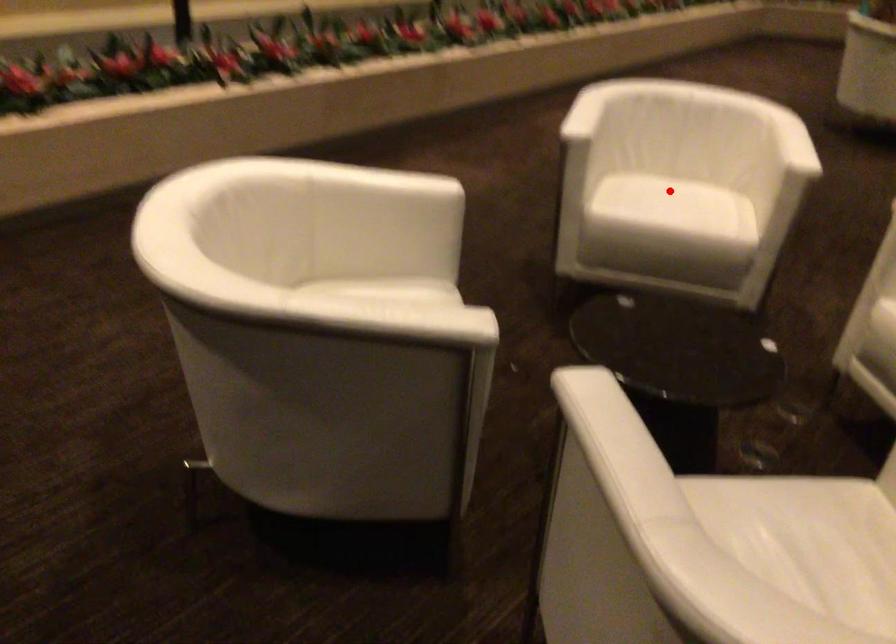
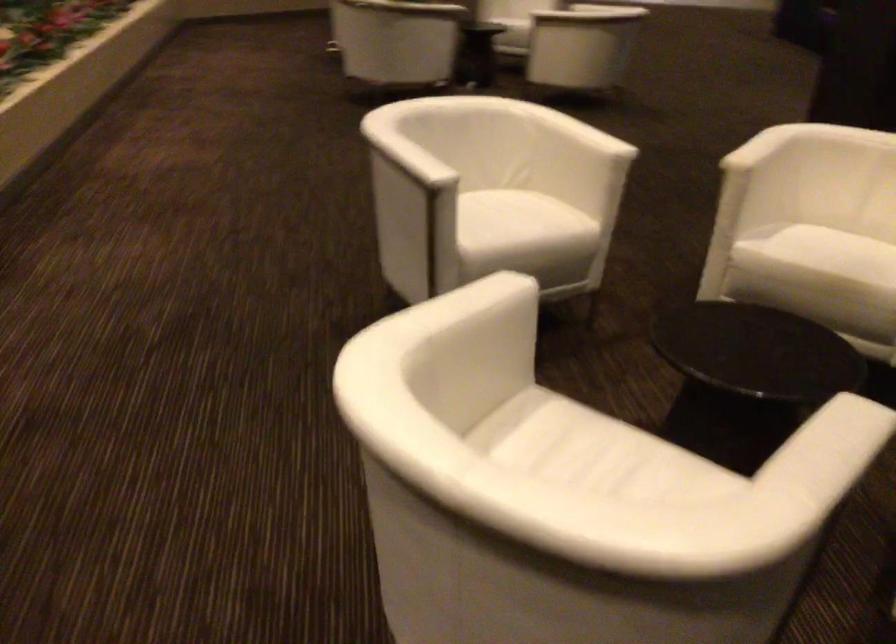
Where in the second image is the point corresponding to the highlighted location from the first image?

(502, 214)